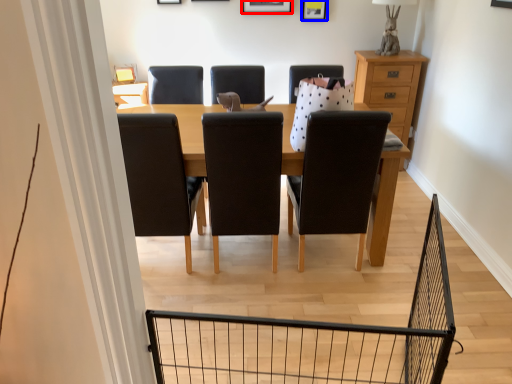
Question: Among these objects, which one is nearest to the camera, picture frame (highlighted by a red box) or picture frame (highlighted by a blue box)?

Choices:
 (A) picture frame
 (B) picture frame

Answer: (A)